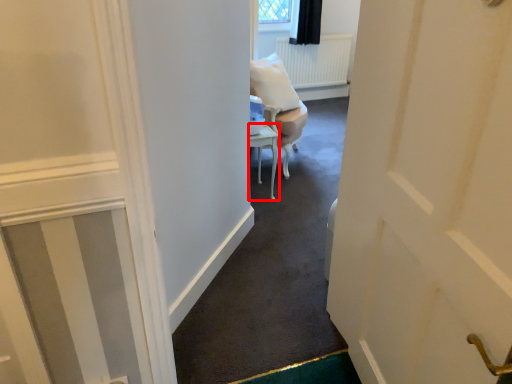
Question: From the image's perspective, considering the relative positions of furniture (annotated by the red box) and chair in the image provided, where is furniture (annotated by the red box) located with respect to the staircase?

Choices:
 (A) below
 (B) above

Answer: (A)